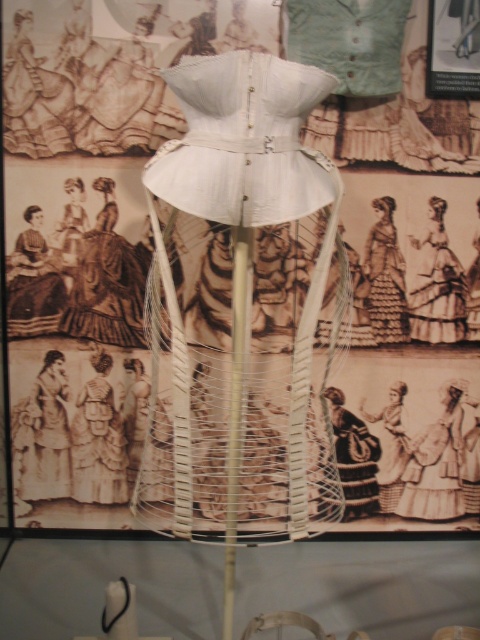
You are a costume designer preparing for a historical play. You need to place a 12 inch wide prop on the floor between the black textured fabric dress at center and the white cotton dress at center. Is there enough space between them to place the prop?

The black textured fabric dress at center is 22.56 inches from the white cotton dress at center. Since the prop is only 12 inches wide, there is sufficient space to place it between them.

You are a curator at a museum and need to place a new exhibit next to the black textured fabric dress at center. The exhibit requires a space that is at least 0.8 units wide in the x and y directions. Can you determine if there is enough space next to the dress?

The black textured fabric dress at center is located at point (355, 458). Since the required space is 0.8 units in both x and y directions, and the dress is placed at 0.716 in x and 0.740 in y, there might not be sufficient space as the coordinates are close to the edges. However, without knowing the total dimensions of the display area, it is impossible to confirm definitively.